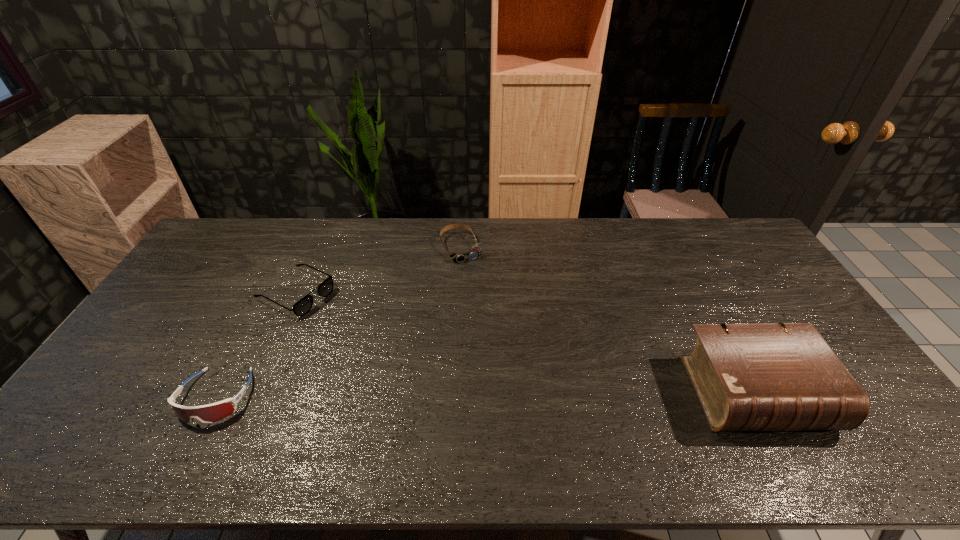
Where is `vacant space on the desktop that is between the nearer goggles and the rightmost object and is positioned on the front-facing side of the right goggles`? The image size is (960, 540). vacant space on the desktop that is between the nearer goggles and the rightmost object and is positioned on the front-facing side of the right goggles is located at coordinates click(x=540, y=394).

This screenshot has width=960, height=540. I want to click on vacant space on the desktop that is between the taller goggles and the Bible and is positioned on the front-facing side of the second farthest object, so click(500, 395).